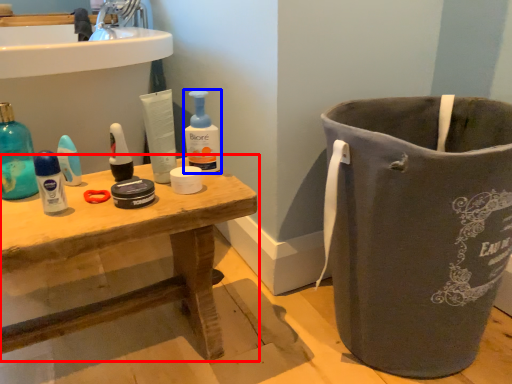
Question: Which object is closer to the camera taking this photo, table (highlighted by a red box) or cleaning product (highlighted by a blue box)?

Choices:
 (A) table
 (B) cleaning product

Answer: (A)